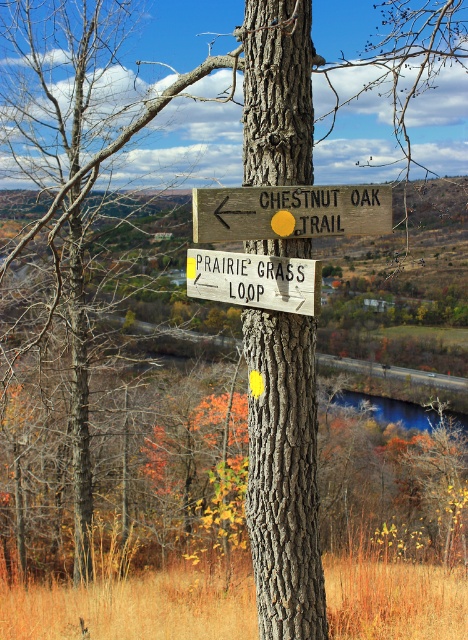
Question: Which point is closer to the camera?

Choices:
 (A) (314, 202)
 (B) (194, 253)
 (C) (248, 352)

Answer: (A)

Question: Can you confirm if gray textured tree trunk at center is bigger than wooden sign at center?

Choices:
 (A) no
 (B) yes

Answer: (B)

Question: Estimate the real-world distances between objects in this image. Which object is closer to the wooden sign at center?

Choices:
 (A) white wooden sign at center
 (B) gray textured tree trunk at center

Answer: (A)

Question: Is gray textured tree trunk at center to the right of wooden sign at center from the viewer's perspective?

Choices:
 (A) no
 (B) yes

Answer: (A)

Question: Which object appears farthest from the camera in this image?

Choices:
 (A) white wooden sign at center
 (B) gray textured tree trunk at center
 (C) wooden sign at center

Answer: (B)

Question: Is gray textured tree trunk at center positioned behind wooden sign at center?

Choices:
 (A) no
 (B) yes

Answer: (B)